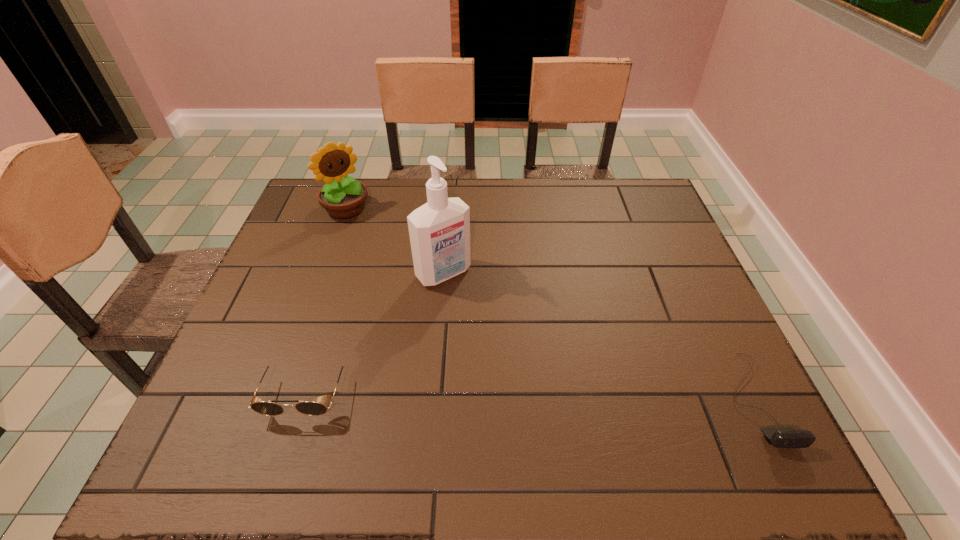
You are a GUI agent. You are given a task and a screenshot of the screen. Output one action in this format:
    pyautogui.click(x=<x>, y=<y>)
    Task: Click on the free space located on the face of the third shortest object
    Image resolution: width=960 pixels, height=540 pixels.
    Given the screenshot: What is the action you would take?
    pyautogui.click(x=397, y=263)

Identify the location of vacant space located 0.080m on the face of the third shortest object. (370, 233).

The height and width of the screenshot is (540, 960). Identify the location of vacant space located on the face of the third shortest object. (413, 279).

I want to click on object situated at the far edge, so click(343, 197).

Where is `sunglasses located at the near edge`? sunglasses located at the near edge is located at coordinates (269, 408).

Identify the location of webcam that is at the near edge. Image resolution: width=960 pixels, height=540 pixels. (781, 437).

This screenshot has height=540, width=960. Identify the location of sunglasses located at the left edge. pos(269,408).

The image size is (960, 540). I want to click on sunflower present at the left edge, so click(x=343, y=197).

Find the location of a particular element. The height and width of the screenshot is (540, 960). object that is at the right edge is located at coordinates (781, 437).

Where is `object that is at the far left corner`? object that is at the far left corner is located at coordinates (343, 197).